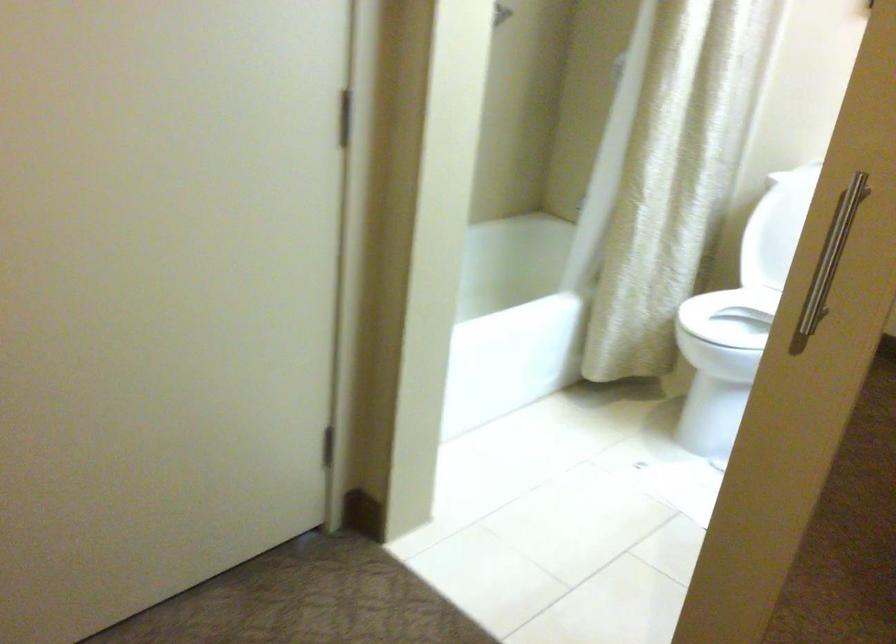
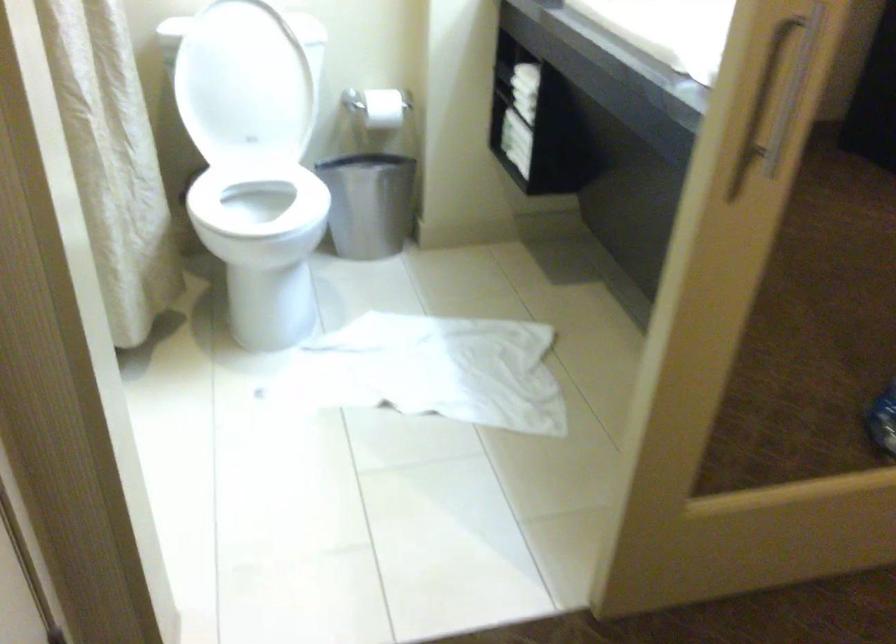
Based on the continuous images, in which direction is the camera rotating?

The camera's rotation is toward right-down.